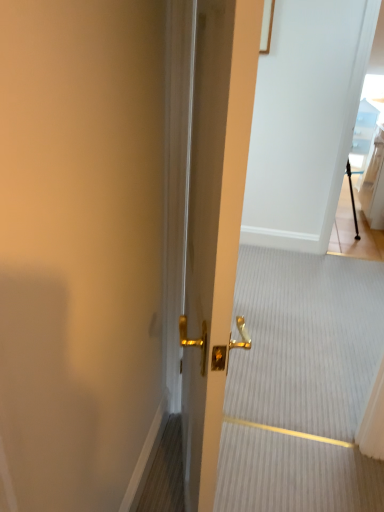
Question: Is point (354, 159) positioned closer to the camera than point (198, 109)?

Choices:
 (A) closer
 (B) farther

Answer: (B)

Question: From a real-world perspective, is transparent glass door at upper right above or below gold metallic door handle at center?

Choices:
 (A) below
 (B) above

Answer: (B)

Question: Estimate the real-world distances between objects in this image. Which object is farther from the gold metallic door handle at center?

Choices:
 (A) metallic gold door handle at center
 (B) transparent glass door at upper right

Answer: (B)

Question: Which object is positioned closest to the gold metallic door handle at center?

Choices:
 (A) metallic gold door handle at center
 (B) transparent glass door at upper right

Answer: (A)